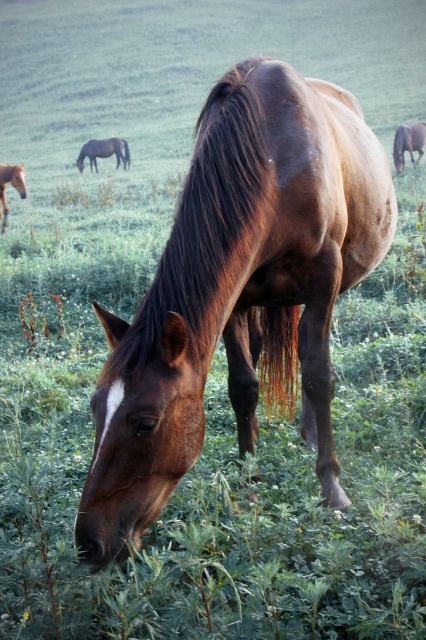
Question: Is brown glossy horse at upper right positioned in front of brown glossy horse at left?

Choices:
 (A) yes
 (B) no

Answer: (B)

Question: Which object is positioned farthest from the brown glossy horse at left?

Choices:
 (A) brown glossy horse at upper right
 (B) brown glossy horse at upper left

Answer: (A)

Question: Among these objects, which one is farthest from the camera?

Choices:
 (A) brown glossy horse at center
 (B) brown glossy horse at upper left
 (C) brown glossy horse at upper right

Answer: (B)

Question: Among these objects, which one is nearest to the camera?

Choices:
 (A) brown glossy horse at center
 (B) brown glossy horse at left
 (C) brown glossy horse at upper right
 (D) brown glossy horse at upper left

Answer: (A)

Question: Can you confirm if brown glossy horse at center is positioned to the left of brown glossy horse at upper left?

Choices:
 (A) no
 (B) yes

Answer: (A)

Question: Is brown glossy horse at center thinner than brown glossy horse at left?

Choices:
 (A) no
 (B) yes

Answer: (A)